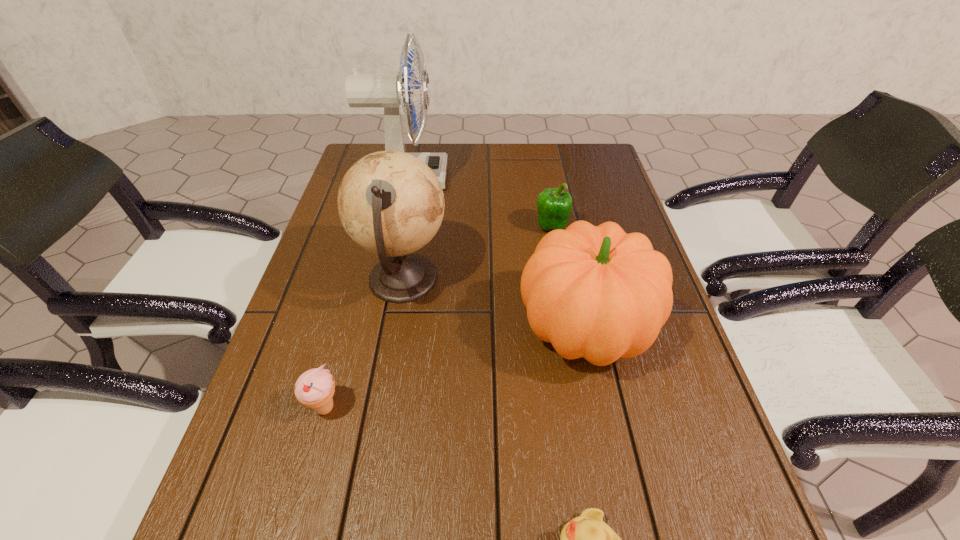
What are the coordinates of `the farthest object` in the screenshot? It's located at (390, 91).

This screenshot has width=960, height=540. In order to click on the tallest object in this screenshot , I will do `click(390, 91)`.

Find the location of `the second tallest object`. the second tallest object is located at coordinates (390, 203).

Locate an element on the screen. pumpkin is located at coordinates (595, 292).

I want to click on bell pepper, so click(x=554, y=205).

Locate an element on the screen. the fifth nearest object is located at coordinates (554, 205).

Locate an element on the screen. The height and width of the screenshot is (540, 960). the second nearest object is located at coordinates (315, 388).

Locate an element on the screen. Image resolution: width=960 pixels, height=540 pixels. the second shortest object is located at coordinates (315, 388).

Where is `vacant area situated 0.090m on the front-facing side of the tallest object`? The height and width of the screenshot is (540, 960). vacant area situated 0.090m on the front-facing side of the tallest object is located at coordinates (475, 178).

The width and height of the screenshot is (960, 540). In order to click on vacant space positioned 0.150m on the front-facing side of the globe in this screenshot , I will do (x=511, y=280).